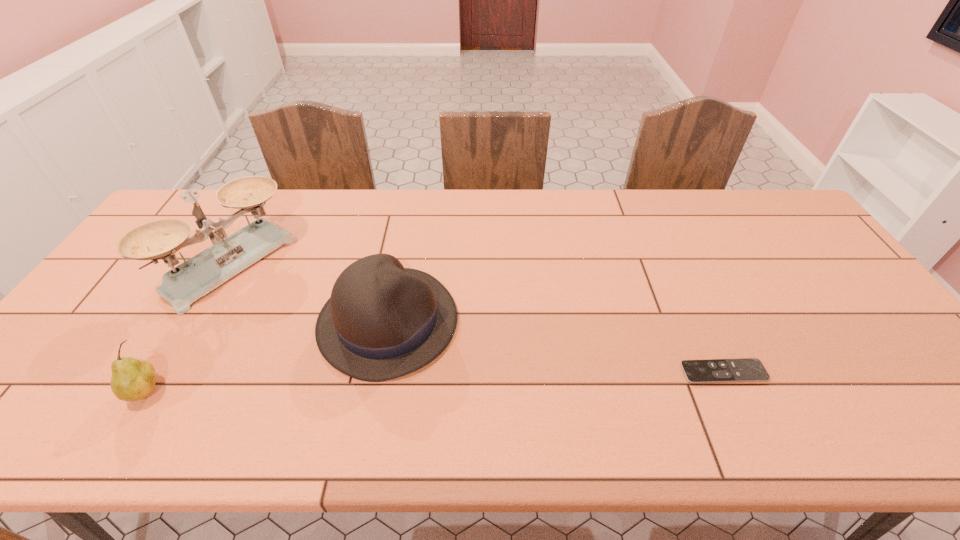
This screenshot has height=540, width=960. Find the location of `vacant space on the desktop that is between the third tallest object and the remote control and is positioned on the front-facing side of the scale`. vacant space on the desktop that is between the third tallest object and the remote control and is positioned on the front-facing side of the scale is located at coordinates (405, 382).

Where is `free spot on the desktop that is between the second shortest object and the shortest object and is positioned on the front-facing side of the third object from left to right`? Image resolution: width=960 pixels, height=540 pixels. free spot on the desktop that is between the second shortest object and the shortest object and is positioned on the front-facing side of the third object from left to right is located at coordinates (516, 379).